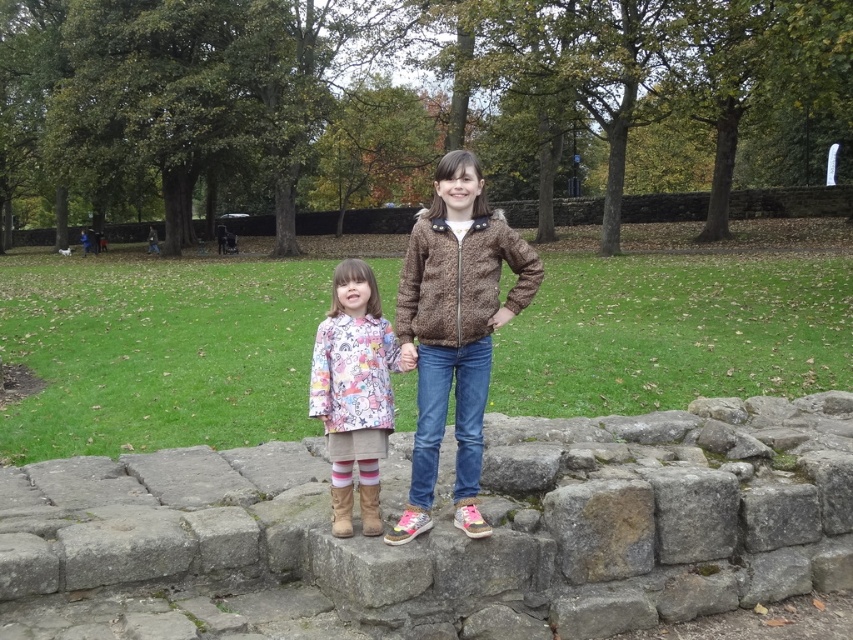
You are a drone operator trying to capture a photo of the two girls standing on the stone wall. You need to position your drone such that the two points, point (491,436) and point (341,452), are visible in the frame. Based on their positions, which point should be closer to the back of the image?

Point (491,436) is behind point (341,452), so in the image, point (491,436) will be closer to the back of the frame.

You are trying to place a small flag on the brown stone at center. Based on the coordinates provided, where exactly should you place the flag?

The brown stone at center is located at point (450, 531), so you should place the flag at those coordinates.

You are a photographer trying to capture a photo of the two girls. You need to position yourself so that you can see both the brown textured jacket at center and the printed fabric coat at center clearly. Based on their positions, which jacket should you focus on first to ensure both are in frame?

Answer: The brown textured jacket at center is to the right of the printed fabric coat at center, so you should focus on the printed fabric coat at center first to ensure both are in frame.